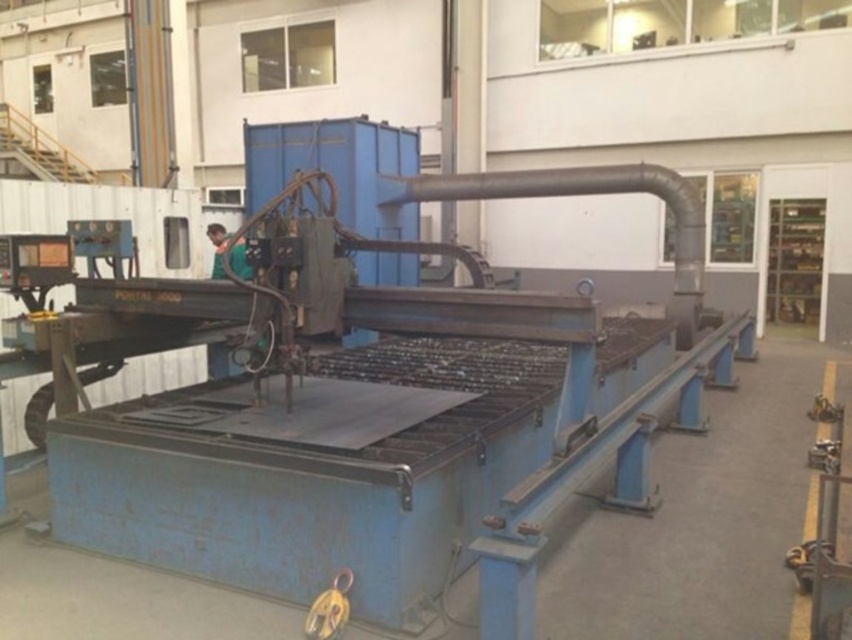
Question: Which point is farther to the camera?

Choices:
 (A) (240, 276)
 (B) (306, 634)

Answer: (A)

Question: Does yellow metallic hook at lower center have a smaller size compared to green fabric shirt at center?

Choices:
 (A) no
 (B) yes

Answer: (B)

Question: Can you confirm if yellow metallic hook at lower center is positioned to the right of green fabric shirt at center?

Choices:
 (A) yes
 (B) no

Answer: (A)

Question: Is yellow metallic hook at lower center behind green fabric shirt at center?

Choices:
 (A) yes
 (B) no

Answer: (B)